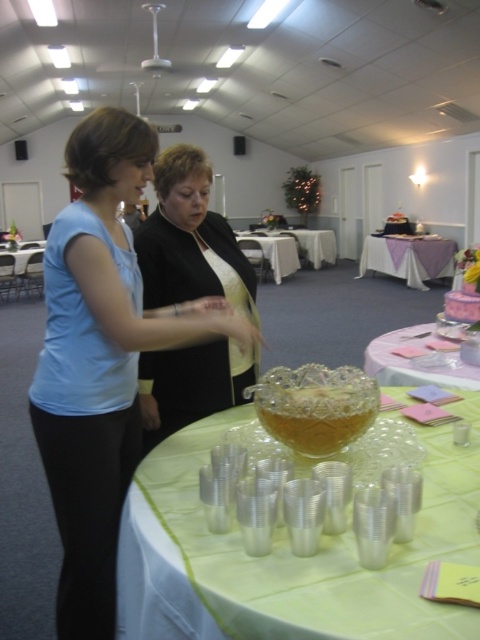
Question: Does green fabric tablecloth at lower center come in front of white plastic table at center?

Choices:
 (A) yes
 (B) no

Answer: (A)

Question: Which point is closer to the camera?

Choices:
 (A) (47, 474)
 (B) (430, 324)
 (C) (282, 260)

Answer: (A)

Question: Which point is closer to the camera?

Choices:
 (A) translucent plastic table at center
 (B) black matte dress at center

Answer: (B)

Question: Which point is closer to the camera?

Choices:
 (A) pink frosted cake at lower right
 (B) white plastic table at center
 (C) white lace tablecloth at center

Answer: (A)

Question: Is matte blue shirt at left below green fabric tablecloth at lower center?

Choices:
 (A) no
 (B) yes

Answer: (A)

Question: Is white lace tablecloth at center in front of white tablecloth at center?

Choices:
 (A) yes
 (B) no

Answer: (A)